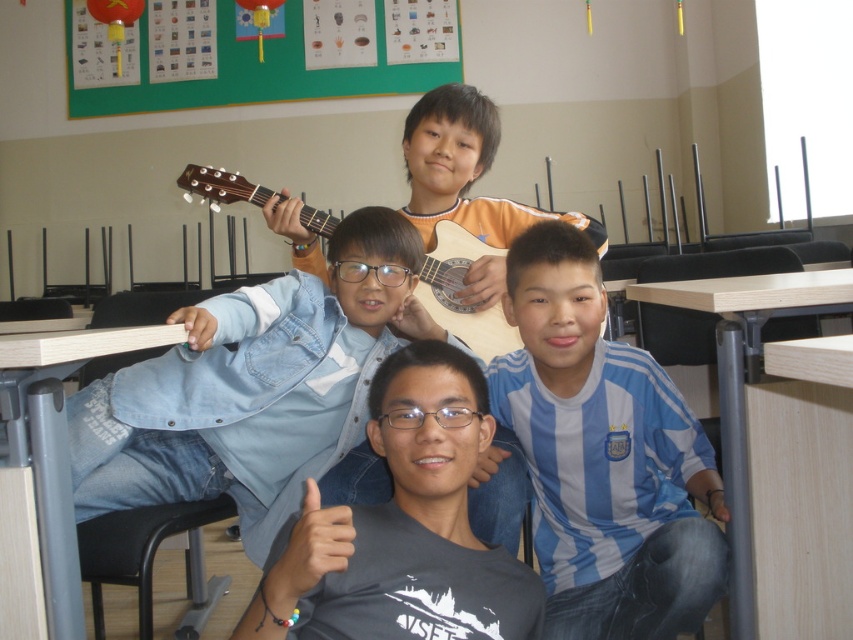
Question: Is gray matte t-shirt at center positioned at the back of denim jacket at center?

Choices:
 (A) no
 (B) yes

Answer: (A)

Question: Considering the real-world distances, which object is closest to the denim jacket at center?

Choices:
 (A) acoustic wood guitar at center
 (B) gray matte t-shirt at center
 (C) blue striped jersey at center

Answer: (A)

Question: Considering the relative positions of denim jacket at center and acoustic wood guitar at center in the image provided, where is denim jacket at center located with respect to acoustic wood guitar at center?

Choices:
 (A) right
 (B) left

Answer: (A)

Question: Is gray matte t-shirt at center to the left of denim jacket at center from the viewer's perspective?

Choices:
 (A) yes
 (B) no

Answer: (A)

Question: Considering the real-world distances, which object is closest to the acoustic wood guitar at center?

Choices:
 (A) denim jacket at center
 (B) gray matte t-shirt at center

Answer: (A)

Question: Which of the following is the farthest from the observer?

Choices:
 (A) denim jacket at center
 (B) gray matte t-shirt at center
 (C) acoustic wood guitar at center
 (D) blue striped jersey at center

Answer: (C)